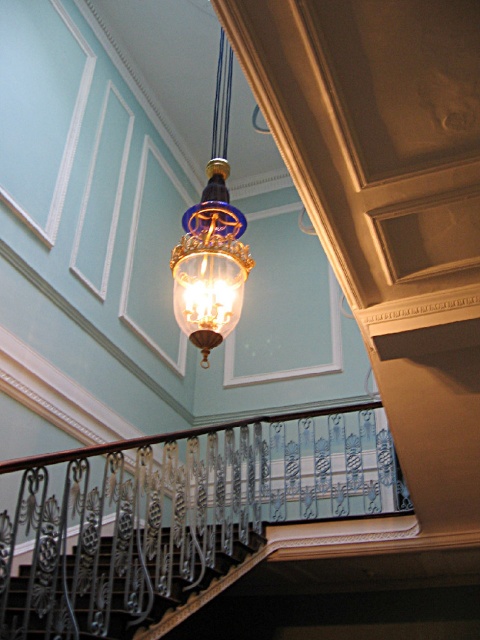
You are standing in the room and want to touch both the black wrought iron railing at center and the translucent glass lamp at center. Which object should you reach for first based on their proximity to you?

The black wrought iron railing at center is closer to the viewer than the translucent glass lamp at center, so you should reach for the black wrought iron railing at center first.

You are standing in the grand hall and want to move from the black wrought iron railing at lower left to the black wrought iron railing at center. Can you step over the space between them?

The black wrought iron railing at center is above the black wrought iron railing at lower left, so you cannot step over the space between them because they are at different vertical levels.